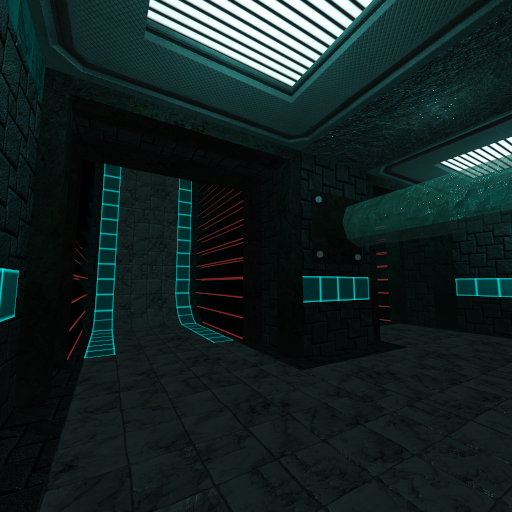
Identify the location of leftmost wall. This screenshot has width=512, height=512. (42, 330).